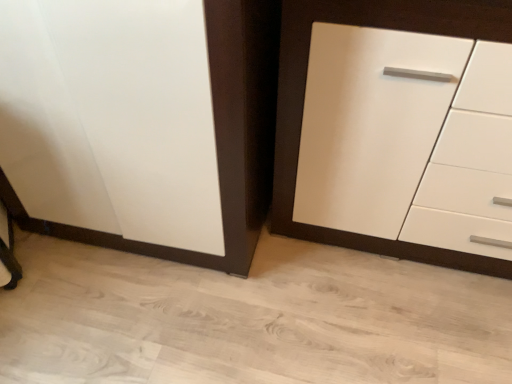
Describe the element at coordinates (276, 122) in the screenshot. I see `white glossy cupboard at left` at that location.

Identify the location of white glossy cupboard at left. (276, 122).

The height and width of the screenshot is (384, 512). Describe the element at coordinates (304, 94) in the screenshot. I see `white glossy cabinet at center right` at that location.

Identify the location of white glossy cabinet at center right. (304, 94).

Find the location of a particular element. The height and width of the screenshot is (384, 512). white glossy cupboard at left is located at coordinates (276, 122).

Is white glossy cabinet at center right at the left side of white glossy cupboard at left?

Incorrect, white glossy cabinet at center right is not on the left side of white glossy cupboard at left.

Is white glossy cabinet at center right further to the viewer compared to white glossy cupboard at left?

No, it is not.

Is point (426, 261) closer to camera compared to point (227, 109)?

No, (426, 261) is further to viewer.

Consider the image. From the image's perspective, which one is positioned higher, white glossy cabinet at center right or white glossy cupboard at left?

white glossy cupboard at left appears higher in the image.

From a real-world perspective, which object rests below the other?

white glossy cupboard at left is physically lower.

Between white glossy cabinet at center right and white glossy cupboard at left, which one has smaller width?

With smaller width is white glossy cabinet at center right.

Between white glossy cabinet at center right and white glossy cupboard at left, which one has less height?

Standing shorter between the two is white glossy cupboard at left.

Is white glossy cabinet at center right bigger or smaller than white glossy cupboard at left?

Clearly, white glossy cabinet at center right is smaller in size than white glossy cupboard at left.

Choose the correct answer: Is white glossy cabinet at center right inside white glossy cupboard at left or outside it?

white glossy cabinet at center right is spatially situated outside white glossy cupboard at left.

Consider the image. Is there a large distance between white glossy cabinet at center right and white glossy cupboard at left?

They are positioned close to each other.

Is white glossy cupboard at left at the back of white glossy cabinet at center right?

No, white glossy cabinet at center right is not facing away from white glossy cupboard at left.

How many degrees apart are the facing directions of white glossy cabinet at center right and white glossy cupboard at left?

The angular difference between white glossy cabinet at center right and white glossy cupboard at left is 0.635 degrees.

What are the coordinates of `cupboard that is above the white glossy cabinet at center right (from the image's perspective)` in the screenshot? It's located at (276, 122).

Which object is positioned more to the left, white glossy cupboard at left or white glossy cabinet at center right?

From the viewer's perspective, white glossy cupboard at left appears more on the left side.

Based on the photo, is white glossy cupboard at left in front of white glossy cabinet at center right?

No, white glossy cupboard at left is further to the viewer.

Which is closer to the camera, (231, 64) or (370, 12)?

The point (231, 64) is more forward.

From the image's perspective, is white glossy cupboard at left located above white glossy cabinet at center right?

Correct, white glossy cupboard at left appears higher than white glossy cabinet at center right in the image.

From a real-world perspective, relative to white glossy cabinet at center right, is white glossy cupboard at left vertically above or below?

In terms of real-world spatial position, white glossy cupboard at left is below white glossy cabinet at center right.

Can you confirm if white glossy cupboard at left is wider than white glossy cabinet at center right?

Correct, the width of white glossy cupboard at left exceeds that of white glossy cabinet at center right.

Between white glossy cupboard at left and white glossy cabinet at center right, which one has more height?

Standing taller between the two is white glossy cabinet at center right.

Considering the sizes of white glossy cupboard at left and white glossy cabinet at center right in the image, is white glossy cupboard at left bigger or smaller than white glossy cabinet at center right?

Clearly, white glossy cupboard at left is larger in size than white glossy cabinet at center right.

Is white glossy cupboard at left located outside white glossy cabinet at center right?

Yes, white glossy cupboard at left is outside of white glossy cabinet at center right.

Is white glossy cupboard at left placed right next to white glossy cabinet at center right?

No, white glossy cupboard at left is not in contact with white glossy cabinet at center right.

Is white glossy cupboard at left turned away from white glossy cabinet at center right?

No, white glossy cabinet at center right is not at the back of white glossy cupboard at left.

How different are the orientations of white glossy cupboard at left and white glossy cabinet at center right in degrees?

0.635 degrees.

Where is `chest of drawers above the white glossy cupboard at left (from a real-world perspective)`? This screenshot has width=512, height=384. chest of drawers above the white glossy cupboard at left (from a real-world perspective) is located at coordinates (304, 94).

In order to click on chest of drawers below the white glossy cupboard at left (from the image's perspective) in this screenshot , I will do coord(304,94).

Where is `cupboard lying on the left of white glossy cabinet at center right`? The width and height of the screenshot is (512, 384). cupboard lying on the left of white glossy cabinet at center right is located at coordinates (276, 122).